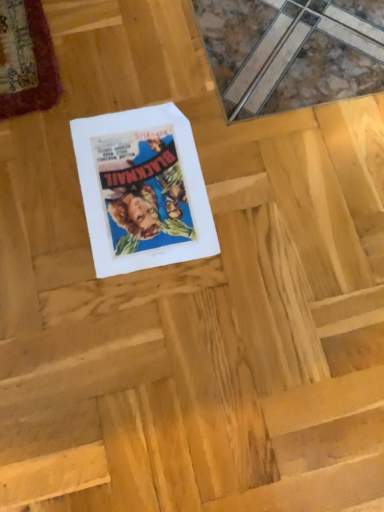
I want to click on white paper at center, so click(142, 190).

What do you see at coordinates (142, 190) in the screenshot?
I see `white paper at center` at bounding box center [142, 190].

In order to click on white paper at center in this screenshot , I will do `click(142, 190)`.